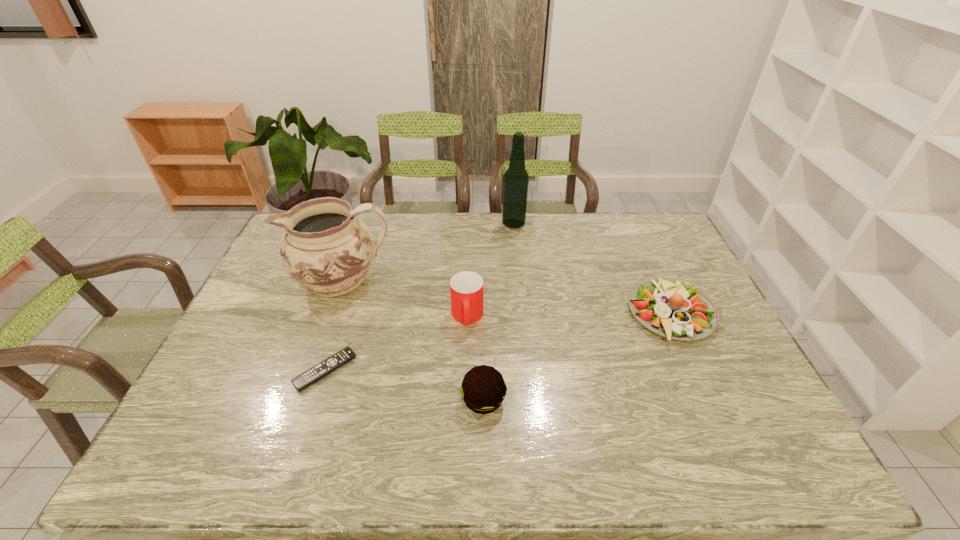
In order to click on the fifth object from left to right in this screenshot , I will do `click(515, 187)`.

Identify the location of alcohol. (515, 187).

Locate an element on the screen. The image size is (960, 540). pitcher is located at coordinates (326, 246).

Locate an element on the screen. This screenshot has width=960, height=540. cup is located at coordinates (466, 288).

Find the location of a particular element. This screenshot has width=960, height=540. patty is located at coordinates (483, 389).

The height and width of the screenshot is (540, 960). In order to click on salad plate in this screenshot , I will do `click(670, 309)`.

The image size is (960, 540). I want to click on the fifth tallest object, so click(670, 309).

The height and width of the screenshot is (540, 960). Find the location of `the shortest object`. the shortest object is located at coordinates (312, 375).

Where is `free region located on the left of the alcohol`? free region located on the left of the alcohol is located at coordinates (463, 224).

Where is `vacant space located on the spout of the second tallest object`? Image resolution: width=960 pixels, height=540 pixels. vacant space located on the spout of the second tallest object is located at coordinates (272, 280).